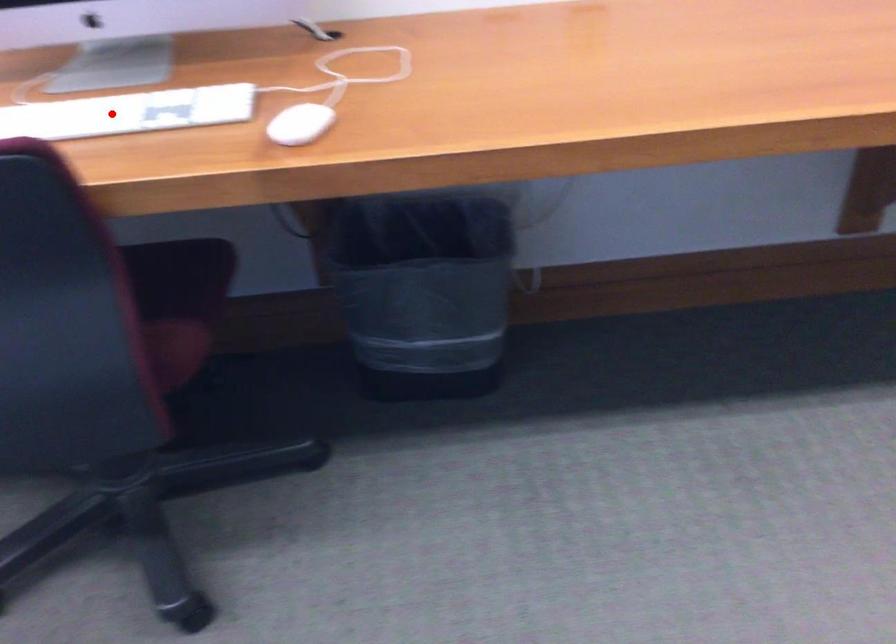
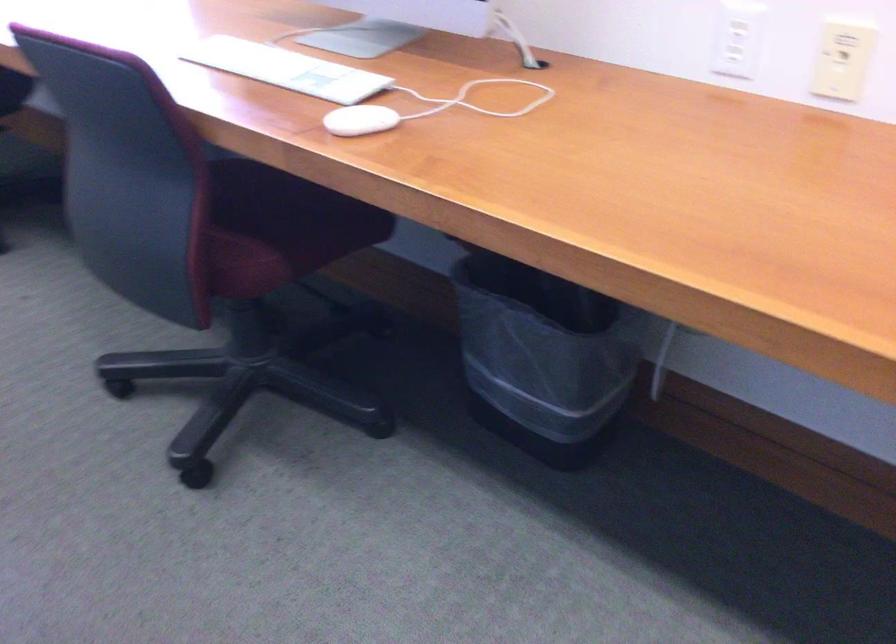
Question: I am providing you with two images of the same scene from different viewpoints. Image1 has a red point marked. In image2, the corresponding 3D location appears at what relative position? Reply with the corresponding letter.

Choices:
 (A) Closer
 (B) Farther

Answer: (B)